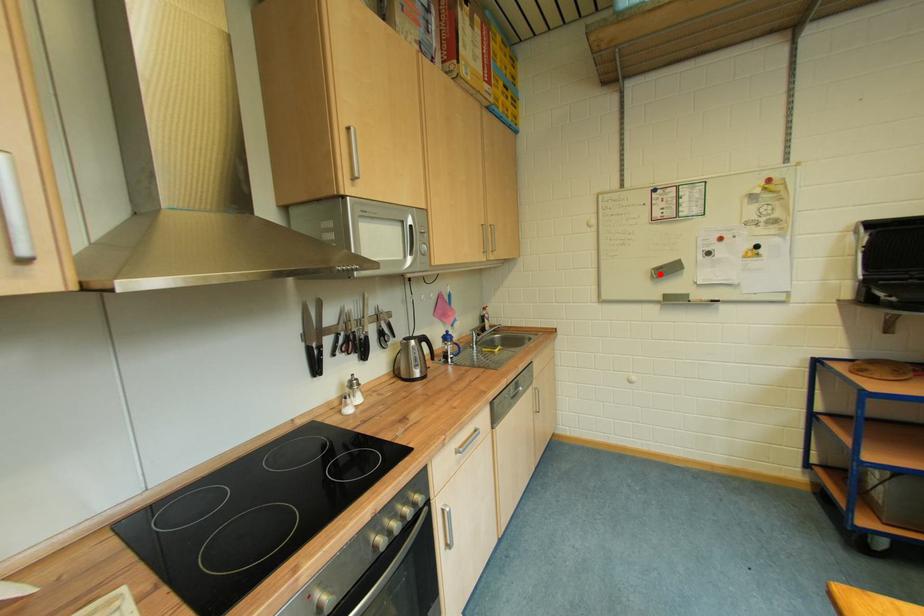
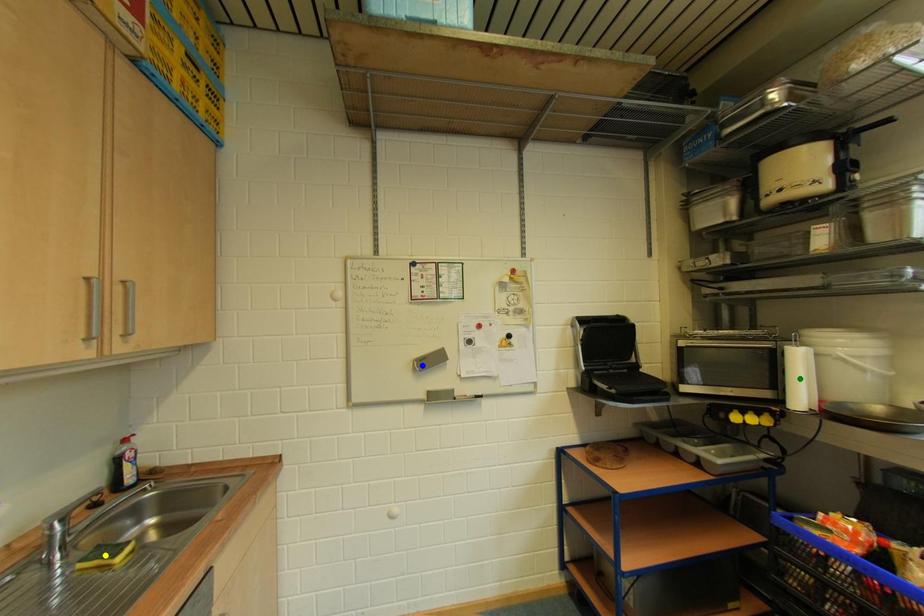
Question: I am providing you with two images of the same scene from different viewpoints. A red point is marked on the first image. You are given multiple points on the second image. Can you choose the point in image 2 that corresponds to the point in image 1?

Choices:
 (A) yellow point
 (B) blue point
 (C) green point

Answer: (B)